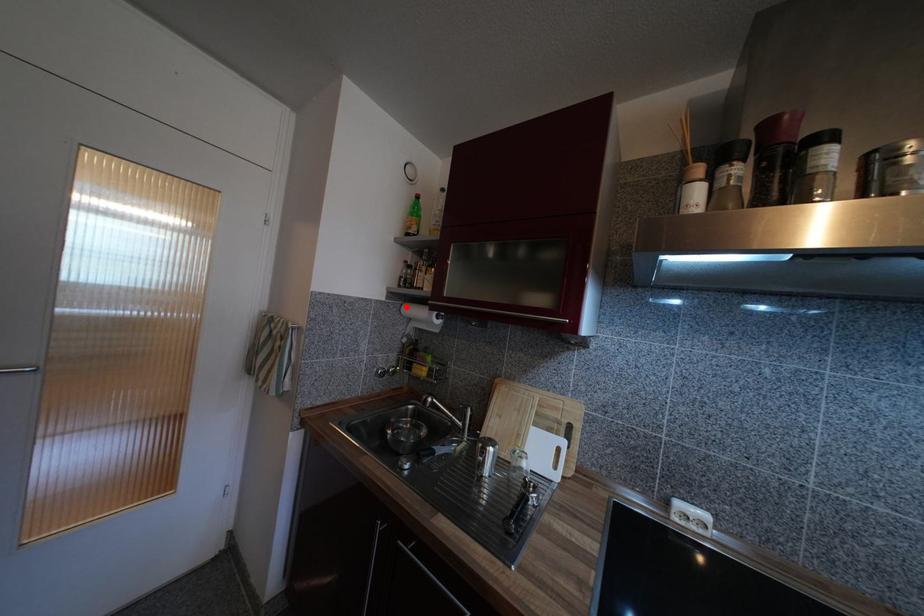
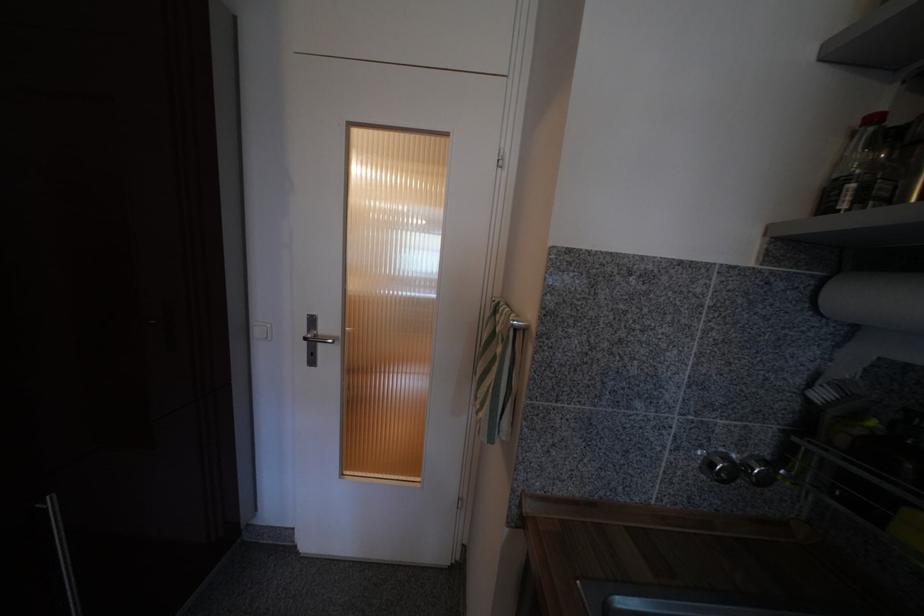
Find the pixel in the second image that matches the highlighted location in the first image.

(828, 282)